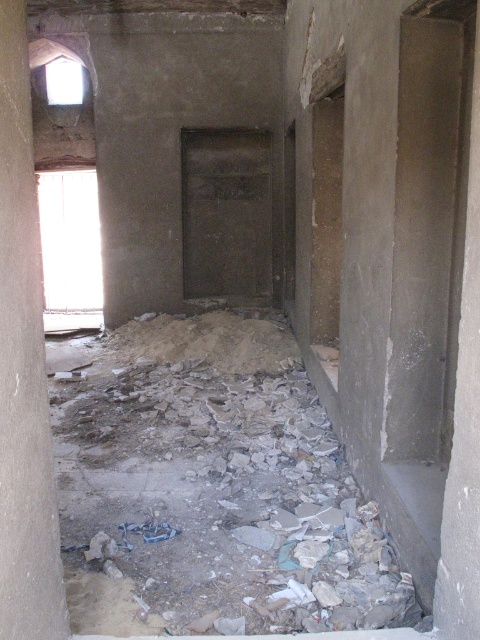
You are a construction worker needing to access the transparent glass window at upper left to inspect it. However, there is crumbly concrete debris at lower center in your path. Based on their positions, which object is closer to your starting position at the entrance door?

The transparent glass window at upper left is closer to your starting position at the entrance door than the crumbly concrete debris at lower center, so you would reach it first.

You are an inspector checking the structural integrity of the gray concrete pillar at left and the transparent glass window at upper left. Which object has a smaller diameter or width?

The gray concrete pillar at left has a smaller diameter than the transparent glass window at upper left.